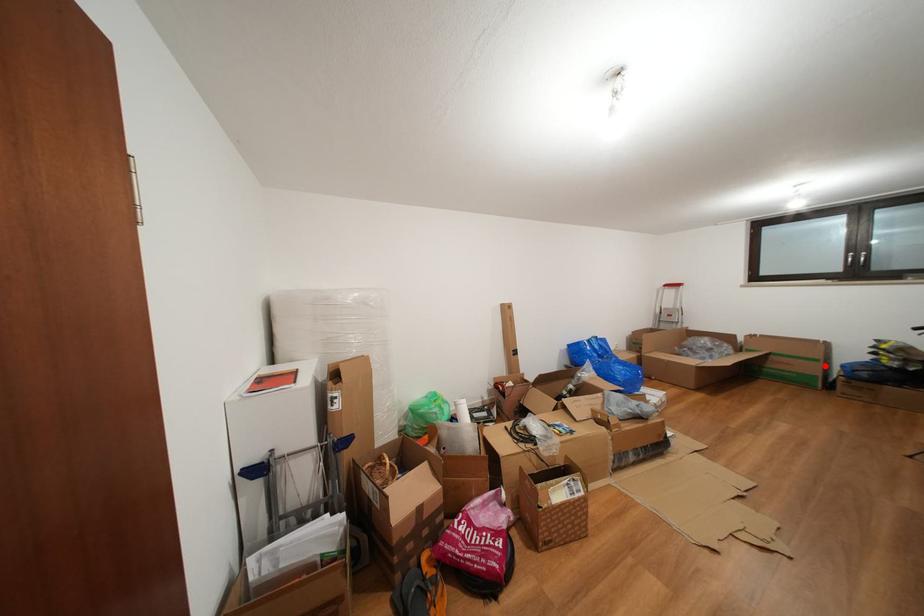
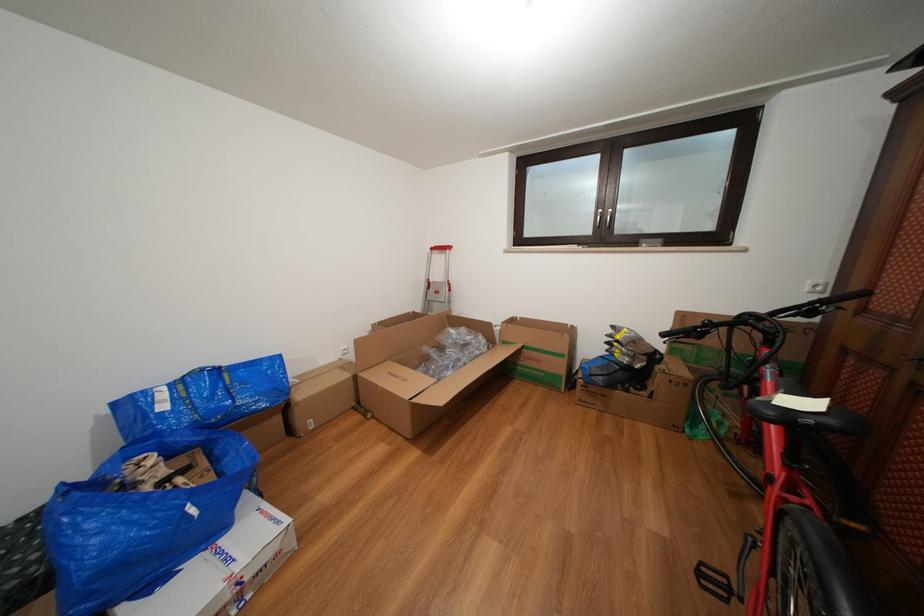
Question: A red point is marked in image1. In image2, is the corresponding 3D point closer to the camera or farther? Reply with the corresponding letter.

Choices:
 (A) The corresponding 3D point is closer.
 (B) The corresponding 3D point is farther.

Answer: (A)